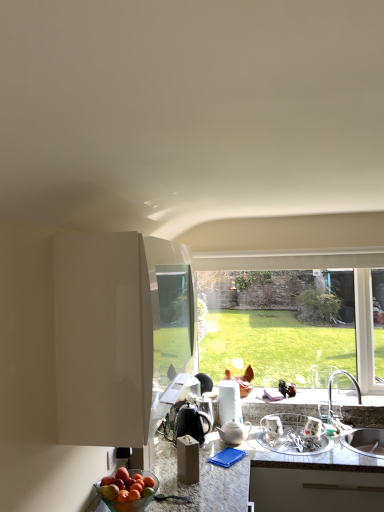
Question: From the image's perspective, does granite countertop at center appear lower than shiny red apple at lower left?

Choices:
 (A) yes
 (B) no

Answer: (A)

Question: Can you confirm if granite countertop at center is taller than shiny red apple at lower left?

Choices:
 (A) yes
 (B) no

Answer: (A)

Question: From a real-world perspective, is granite countertop at center physically above shiny red apple at lower left?

Choices:
 (A) yes
 (B) no

Answer: (B)

Question: Is granite countertop at center positioned with its back to shiny red apple at lower left?

Choices:
 (A) yes
 (B) no

Answer: (B)

Question: Considering the relative sizes of granite countertop at center and shiny red apple at lower left in the image provided, is granite countertop at center wider than shiny red apple at lower left?

Choices:
 (A) yes
 (B) no

Answer: (A)

Question: Is shiny red apple at lower left completely or partially inside granite countertop at center?

Choices:
 (A) yes
 (B) no

Answer: (A)

Question: Is metallic silver dish rack at lower right, the 1th appliance viewed from the right, oriented away from shiny metallic kettle at center, marked as the 3th appliance in a right-to-left arrangement?

Choices:
 (A) no
 (B) yes

Answer: (A)

Question: Is shiny metallic kettle at center, marked as the 3th appliance in a right-to-left arrangement, located within metallic silver dish rack at lower right, the 1th appliance viewed from the right?

Choices:
 (A) no
 (B) yes

Answer: (A)

Question: Does metallic silver dish rack at lower right, the 1th appliance viewed from the right, appear on the right side of shiny metallic kettle at center, acting as the first appliance starting from the left?

Choices:
 (A) yes
 (B) no

Answer: (A)

Question: Is metallic silver dish rack at lower right, marked as the third appliance in a left-to-right arrangement, outside of shiny metallic kettle at center, marked as the 3th appliance in a right-to-left arrangement?

Choices:
 (A) no
 (B) yes

Answer: (B)

Question: Is metallic silver dish rack at lower right, the 1th appliance viewed from the right, to the left of shiny metallic kettle at center, acting as the first appliance starting from the left, from the viewer's perspective?

Choices:
 (A) yes
 (B) no

Answer: (B)

Question: From a real-world perspective, is metallic silver dish rack at lower right, marked as the third appliance in a left-to-right arrangement, located higher than shiny metallic kettle at center, marked as the 3th appliance in a right-to-left arrangement?

Choices:
 (A) no
 (B) yes

Answer: (A)

Question: From the image's perspective, would you say granite countertop at center is shown under metallic silver dish rack at lower right, marked as the third appliance in a left-to-right arrangement?

Choices:
 (A) yes
 (B) no

Answer: (A)